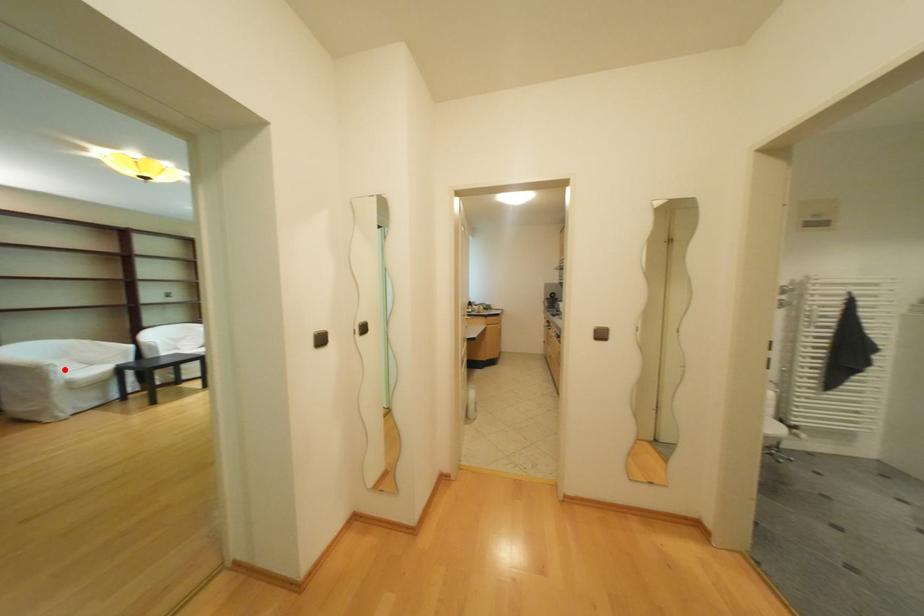
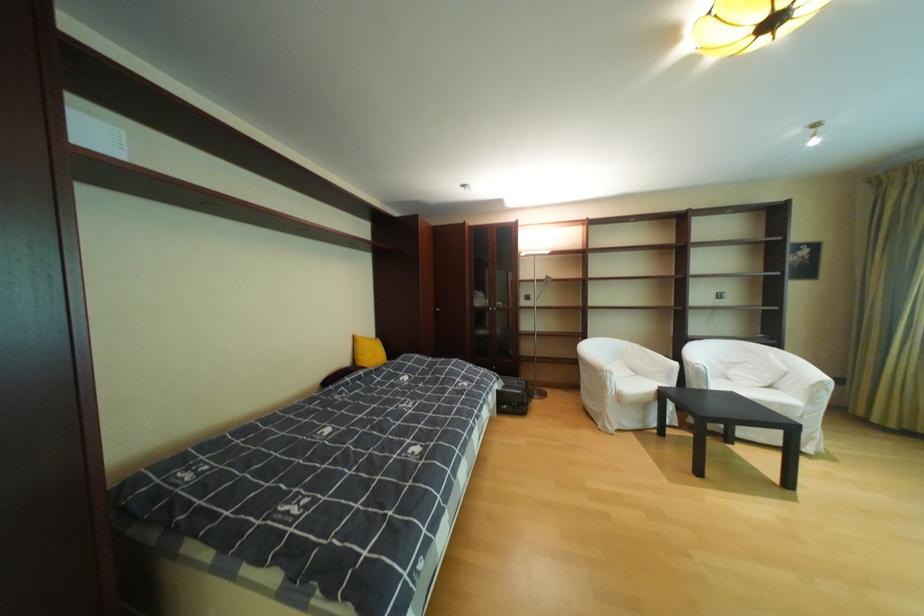
Question: A red point is marked in image1. In image2, is the corresponding 3D point closer to the camera or farther? Reply with the corresponding letter.

Choices:
 (A) The corresponding 3D point is closer.
 (B) The corresponding 3D point is farther.

Answer: (B)